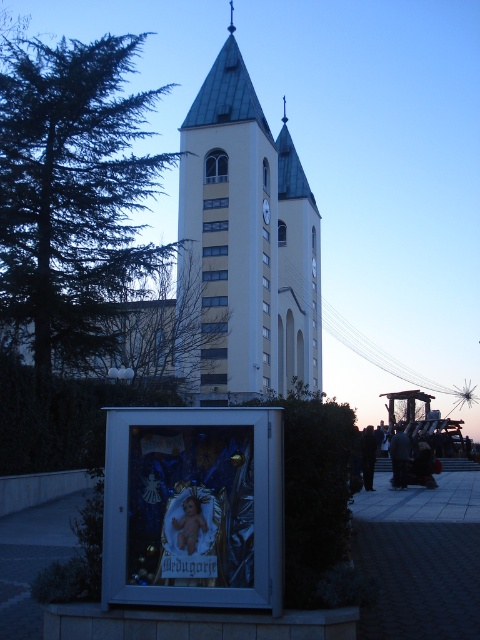
Is yellow concrete tower at center to the left of white glossy clock at center from the viewer's perspective?

Yes, yellow concrete tower at center is to the left of white glossy clock at center.

Does point (217, 392) lie in front of point (267, 209)?

Yes, it is.

This screenshot has height=640, width=480. In order to click on yellow concrete tower at center in this screenshot , I will do point(247,241).